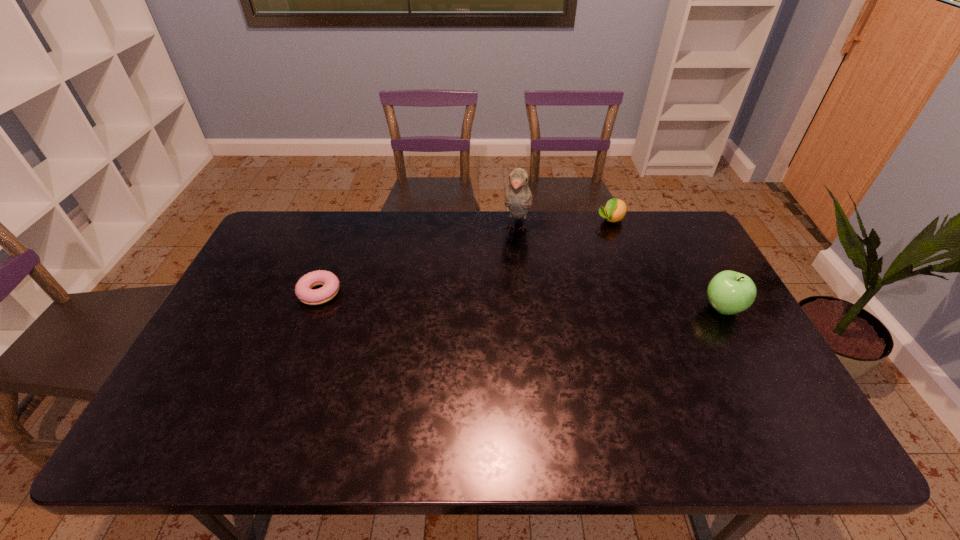
The width and height of the screenshot is (960, 540). I want to click on the leftmost object, so click(303, 290).

This screenshot has height=540, width=960. I want to click on the shortest object, so click(303, 290).

Image resolution: width=960 pixels, height=540 pixels. Identify the location of apple. (729, 292).

You are a GUI agent. You are given a task and a screenshot of the screen. Output one action in this format:
    pyautogui.click(x=<x>, y=<y>)
    Task: Click on the rightmost object
    This screenshot has height=540, width=960.
    Given the screenshot: What is the action you would take?
    (x=729, y=292)

I want to click on the tallest object, so click(x=518, y=198).

This screenshot has width=960, height=540. I want to click on the second object from left to right, so click(x=518, y=198).

The height and width of the screenshot is (540, 960). I want to click on the second object from right to left, so [x=614, y=211].

I want to click on lemon, so click(x=614, y=211).

Where is `free space located on the front of the shortest object`? The height and width of the screenshot is (540, 960). free space located on the front of the shortest object is located at coordinates (306, 327).

This screenshot has width=960, height=540. I want to click on vacant region located 0.210m on the front of the rightmost object, so click(768, 390).